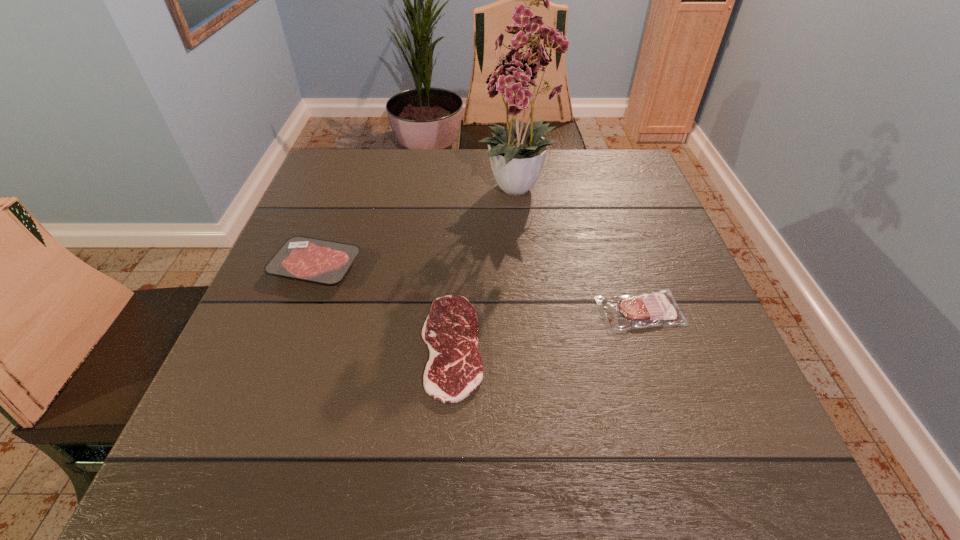
Find the location of `free space between the second steak from right to left and the third tallest object`. free space between the second steak from right to left and the third tallest object is located at coordinates (546, 329).

Locate an element on the screen. Image resolution: width=960 pixels, height=540 pixels. object that is the closest to the shortest steak is located at coordinates (x=314, y=260).

Locate an element on the screen. Image resolution: width=960 pixels, height=540 pixels. object that is the third closest to the tallest object is located at coordinates (314, 260).

Image resolution: width=960 pixels, height=540 pixels. Find the location of `steak object that ranks as the third closest to the flower arrangement`. steak object that ranks as the third closest to the flower arrangement is located at coordinates [x=314, y=260].

Identify which steak is located as the nearest to the rightmost object. Please provide its 2D coordinates. Your answer should be formatted as a tuple, i.e. [(x, y)], where the tuple contains the x and y coordinates of a point satisfying the conditions above.

[(454, 370)]

Identify the location of free region that satisfies the following two spatial constraints: 1. on the front side of the second steak from left to right; 2. on the left side of the tallest steak. (286, 346).

Identify the location of free space that satisfies the following two spatial constraints: 1. on the front side of the rightmost steak; 2. on the right side of the tallest steak. This screenshot has width=960, height=540. (299, 312).

Find the location of a particular element. vacant space that satisfies the following two spatial constraints: 1. on the front-facing side of the second shortest steak; 2. on the right side of the flower arrangement is located at coordinates [533, 312].

Find the location of a particular element. The height and width of the screenshot is (540, 960). vacant space that satisfies the following two spatial constraints: 1. on the front-facing side of the second shortest steak; 2. on the right side of the tallest object is located at coordinates (533, 312).

Locate an element on the screen. This screenshot has width=960, height=540. vacant area that satisfies the following two spatial constraints: 1. on the front-facing side of the rightmost steak; 2. on the left side of the farthest object is located at coordinates (533, 312).